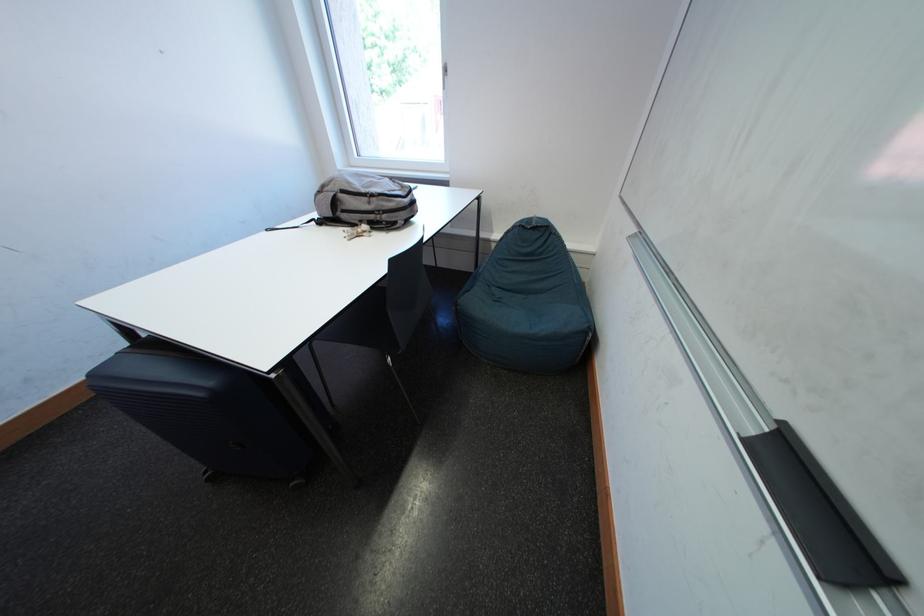
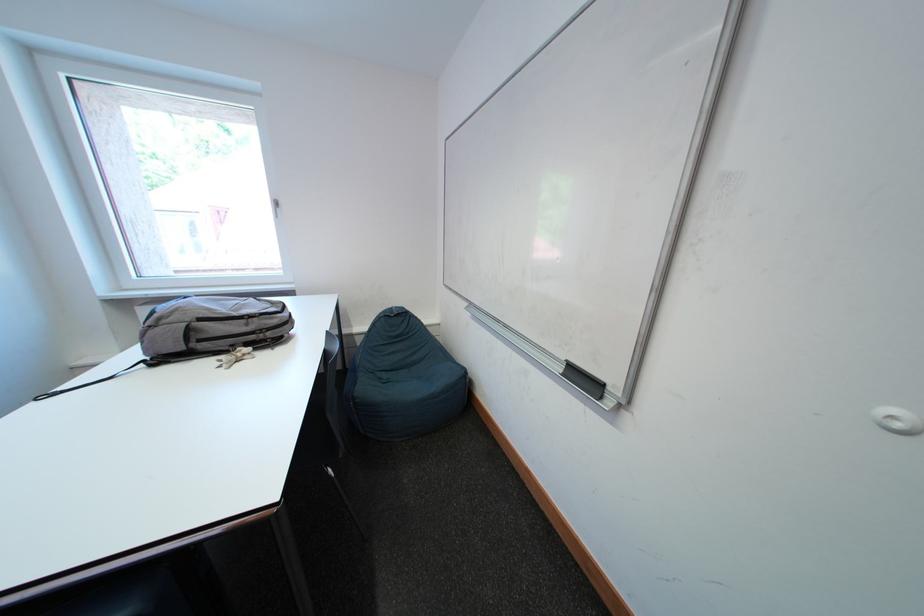
Question: The camera is either moving clockwise (left) or counter-clockwise (right) around the object. The first image is from the beginning of the video and the second image is from the end. Is the camera moving left or right when shooting the video?

Choices:
 (A) Left
 (B) Right

Answer: (A)